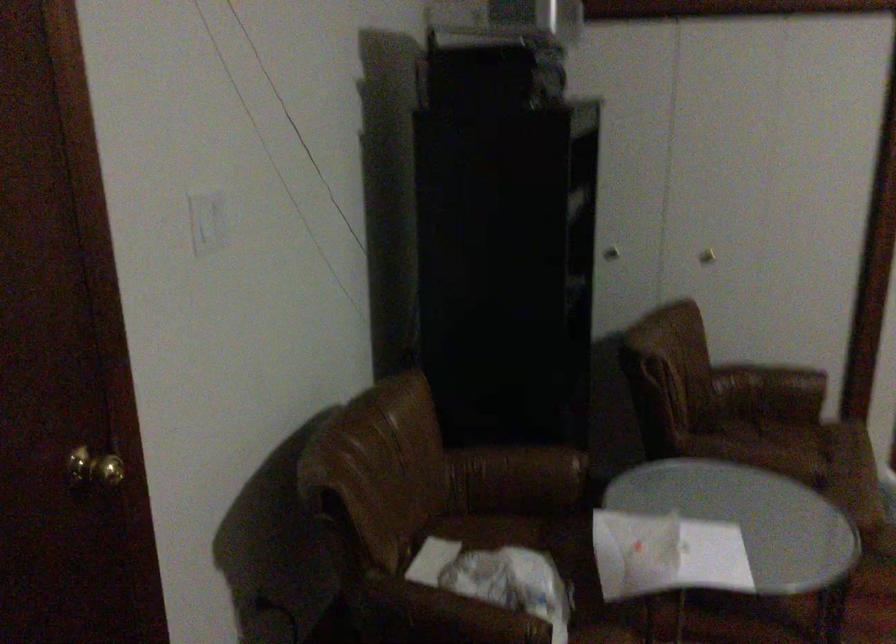
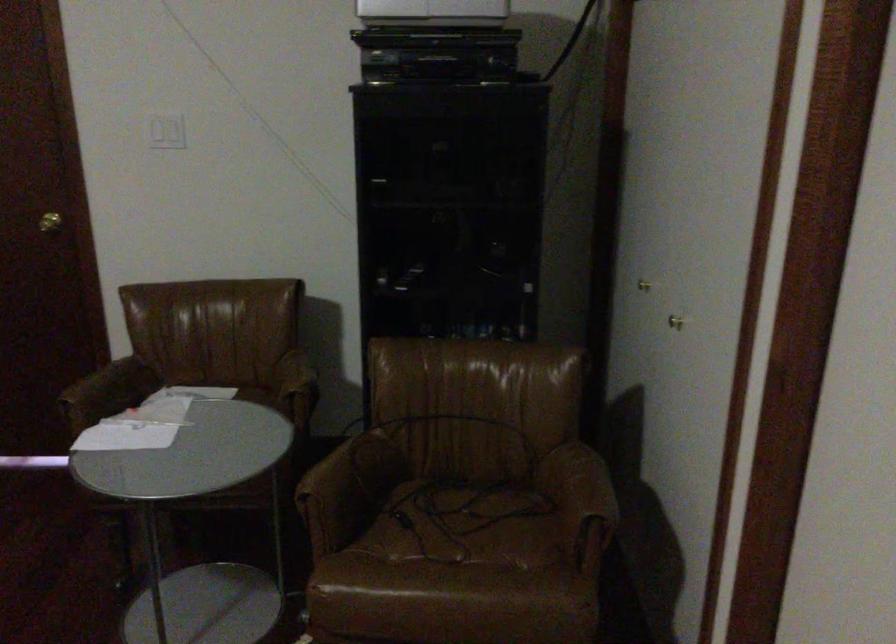
Locate, in the second image, the point that corresponds to (780,371) in the first image.

(582, 485)